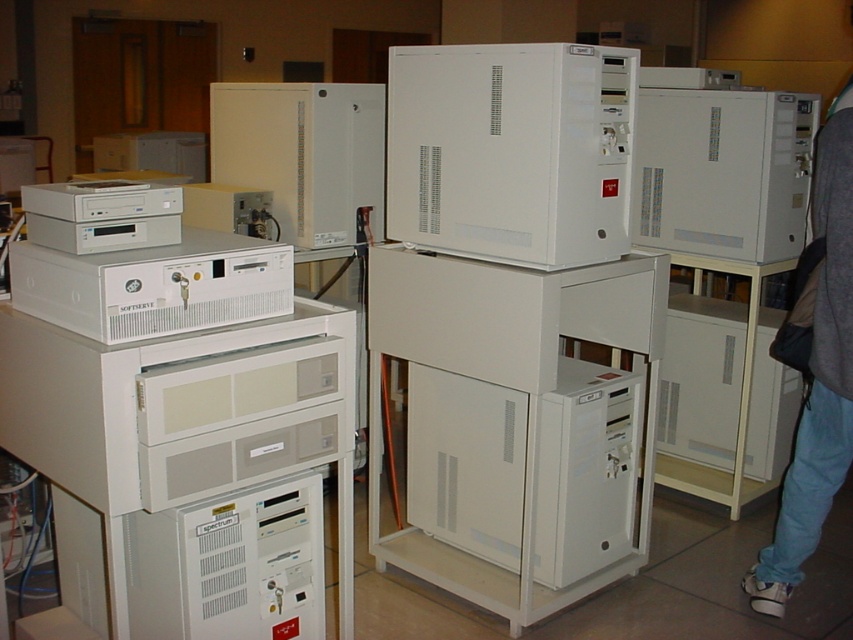
In the scene shown: Between white plastic cabinet at upper center and jeans at lower right, which one has less height?

With less height is white plastic cabinet at upper center.

Does point (213, 104) come in front of point (836, 99)?

No, it is behind (836, 99).

Locate an element on the screen. The image size is (853, 640). white plastic cabinet at upper center is located at coordinates (303, 154).

Can you confirm if white matte computer tower at center is wider than jeans at lower right?

Yes.

Who is more forward, (553, 49) or (821, 330)?

Point (553, 49)

You are a GUI agent. You are given a task and a screenshot of the screen. Output one action in this format:
    pyautogui.click(x=<x>, y=<y>)
    Task: Click on the white matte computer tower at center
    This screenshot has width=853, height=640.
    Given the screenshot: What is the action you would take?
    pyautogui.click(x=511, y=150)

Identify the location of white matte computer tower at center. Image resolution: width=853 pixels, height=640 pixels. (511, 150).

Locate an element on the screen. This screenshot has height=640, width=853. white matte computer tower at center is located at coordinates (511, 150).